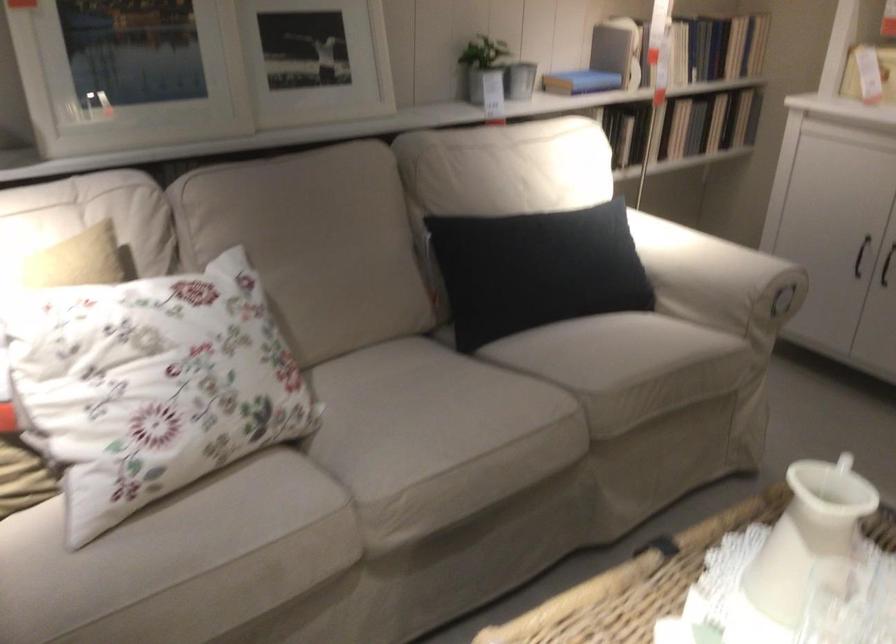
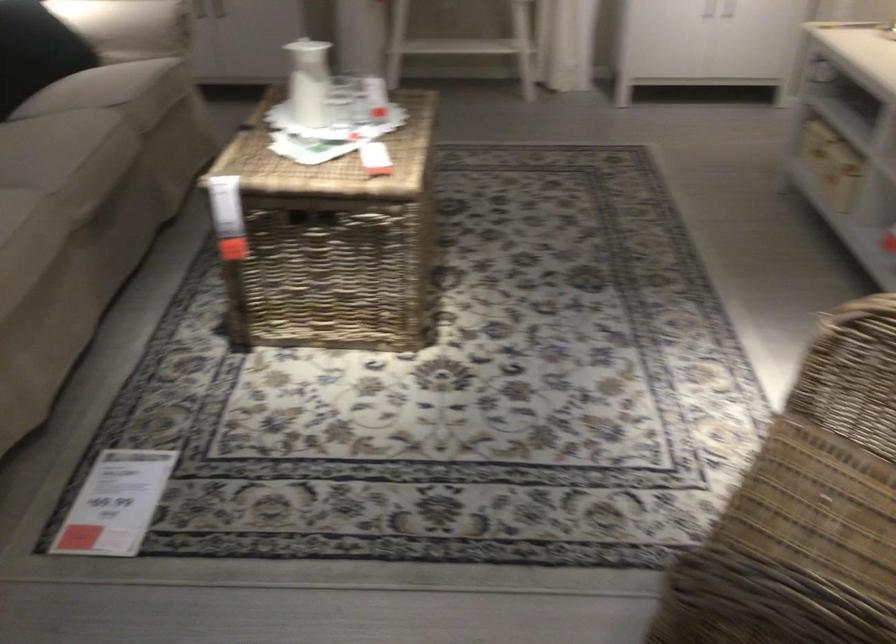
In the second image, find the point that corresponds to pixel 778 541 in the first image.

(308, 82)